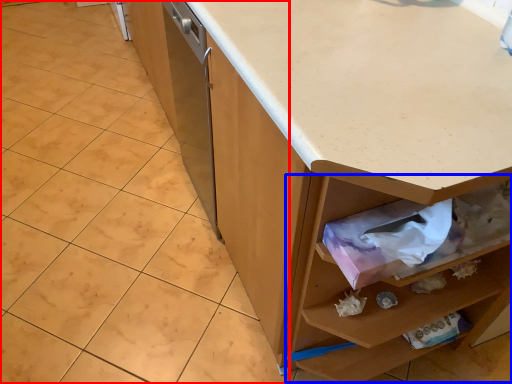
Question: Which object appears closest to the camera in this image, granite (highlighted by a red box) or drawer (highlighted by a blue box)?

Choices:
 (A) granite
 (B) drawer

Answer: (B)